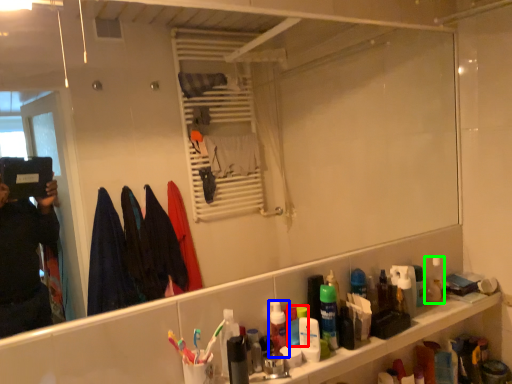
Question: Estimate the real-world distances between objects in this image. Which object is farther from mouthwash (highlighted by a red box), mouthwash (highlighted by a blue box) or mouthwash (highlighted by a green box)?

Choices:
 (A) mouthwash
 (B) mouthwash

Answer: (B)